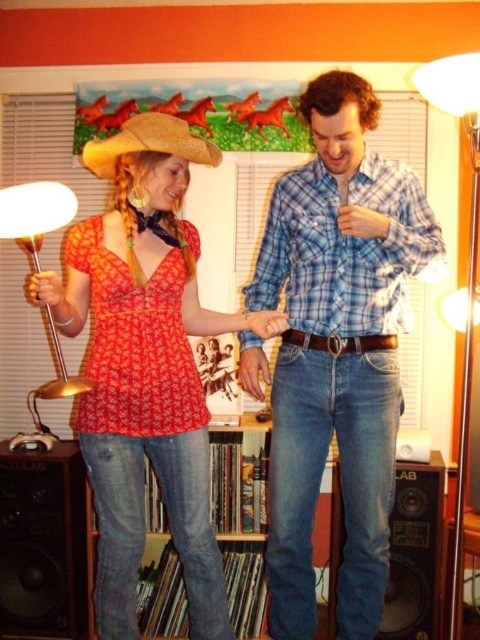
Question: Is blue plaid shirt at center closer to camera compared to matte red blouse at center?

Choices:
 (A) yes
 (B) no

Answer: (A)

Question: Based on their relative distances, which object is farther from the brown leather belt at center?

Choices:
 (A) gold metallic lamp at left
 (B) blue plaid shirt at center
 (C) black matte speaker at lower left

Answer: (C)

Question: Among these points, which one is nearest to the camera?

Choices:
 (A) (446, 56)
 (B) (136, 120)

Answer: (B)

Question: Can you confirm if blue plaid shirt at center is wider than matte gold floor lamp at right?

Choices:
 (A) yes
 (B) no

Answer: (A)

Question: Which object is farther from the camera taking this photo?

Choices:
 (A) gold metallic lamp at left
 (B) matte red blouse at center
 (C) black matte speaker at lower left
 (D) brown leather belt at center

Answer: (C)

Question: Can you confirm if matte red blouse at center is positioned below strawhat at upper left?

Choices:
 (A) no
 (B) yes

Answer: (B)